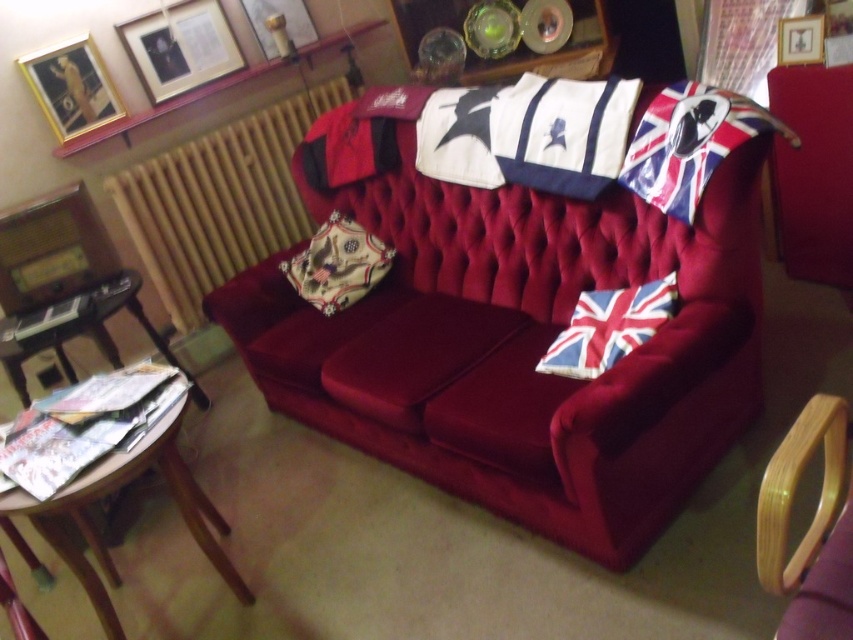
Question: From the image, what is the correct spatial relationship of wooden armchair at lower right in relation to union jack fabric flag at upper right?

Choices:
 (A) left
 (B) right

Answer: (A)

Question: Which point is closer to the camera taking this photo?

Choices:
 (A) (61, 56)
 (B) (271, 8)
 (C) (816, 237)
 (D) (801, 52)

Answer: (D)

Question: Which point appears closest to the camera in this image?

Choices:
 (A) (804, 550)
 (B) (256, 156)
 (C) (374, 138)
 (D) (303, 42)

Answer: (A)

Question: Estimate the real-world distances between objects in this image. Which object is farther from the wooden round table at lower left?

Choices:
 (A) whitematerialflag at upper center
 (B) union jack fabric pillow at right

Answer: (A)

Question: Is wooden radiator at upper center thinner than metallic gold picture frame at upper center?

Choices:
 (A) yes
 (B) no

Answer: (B)

Question: Is union jack fabric pillow at right to the right of metallic gold picture frame at upper center from the viewer's perspective?

Choices:
 (A) yes
 (B) no

Answer: (A)